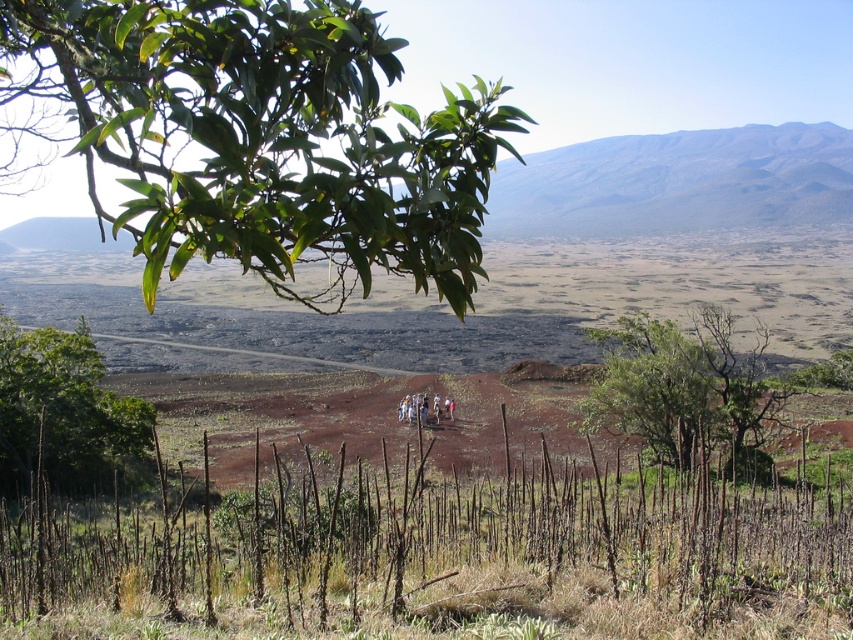
Is green glossy leaves at upper left to the left of green leafy tree at center from the viewer's perspective?

Indeed, green glossy leaves at upper left is positioned on the left side of green leafy tree at center.

How much distance is there between green glossy leaves at upper left and green leafy tree at center?

They are 90.27 feet apart.

The image size is (853, 640). I want to click on green glossy leaves at upper left, so click(x=259, y=138).

Is green leafy tree at center shorter than green leafy tree at lower left?

Incorrect, green leafy tree at center's height does not fall short of green leafy tree at lower left's.

Is green leafy tree at center above green leafy tree at lower left?

No.

Which is in front, point (778, 401) or point (62, 362)?

Point (62, 362)

I want to click on green leafy tree at center, so click(683, 387).

The width and height of the screenshot is (853, 640). In order to click on green glossy leaves at upper left in this screenshot , I will do `click(259, 138)`.

Between point (438, 170) and point (38, 435), which one is positioned in front?

Point (438, 170)

Is point (368, 152) in front of point (99, 401)?

That is True.

You are a GUI agent. You are given a task and a screenshot of the screen. Output one action in this format:
    pyautogui.click(x=<x>, y=<y>)
    Task: Click on the green glossy leaves at upper left
    
    Given the screenshot: What is the action you would take?
    pyautogui.click(x=259, y=138)